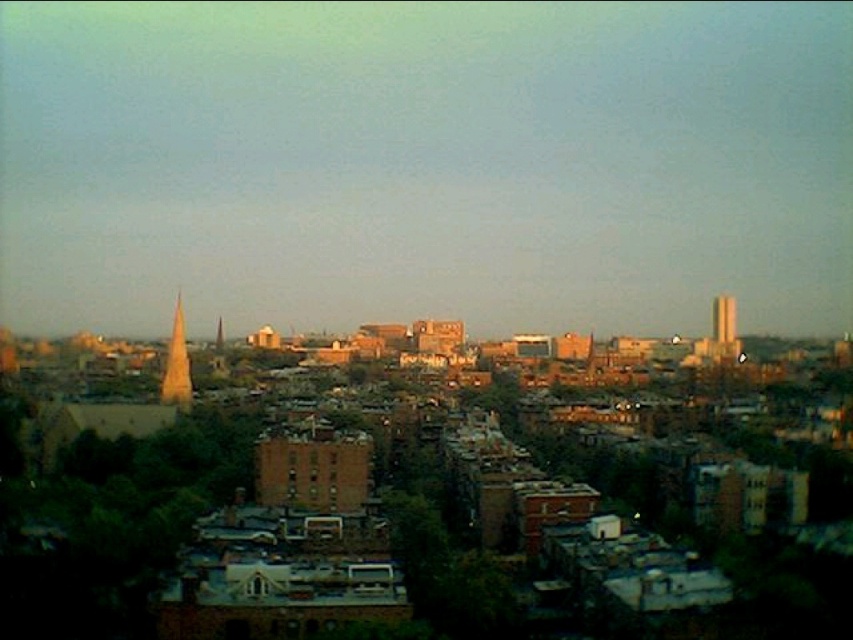
Question: Which point appears closest to the camera in this image?

Choices:
 (A) pos(172,332)
 (B) pos(222,340)
 (C) pos(730,340)

Answer: (A)

Question: Can you confirm if golden glass spire at left is thinner than brick tower at right?

Choices:
 (A) no
 (B) yes

Answer: (A)

Question: Is brick tower at right further to camera compared to smooth gold spire at left?

Choices:
 (A) no
 (B) yes

Answer: (A)

Question: Which object is positioned farthest from the smooth gold spire at left?

Choices:
 (A) brick tower at right
 (B) golden glass spire at left

Answer: (A)

Question: Is golden glass spire at left in front of brick tower at right?

Choices:
 (A) no
 (B) yes

Answer: (B)

Question: Which object is closer to the camera taking this photo?

Choices:
 (A) smooth gold spire at left
 (B) golden glass spire at left

Answer: (B)